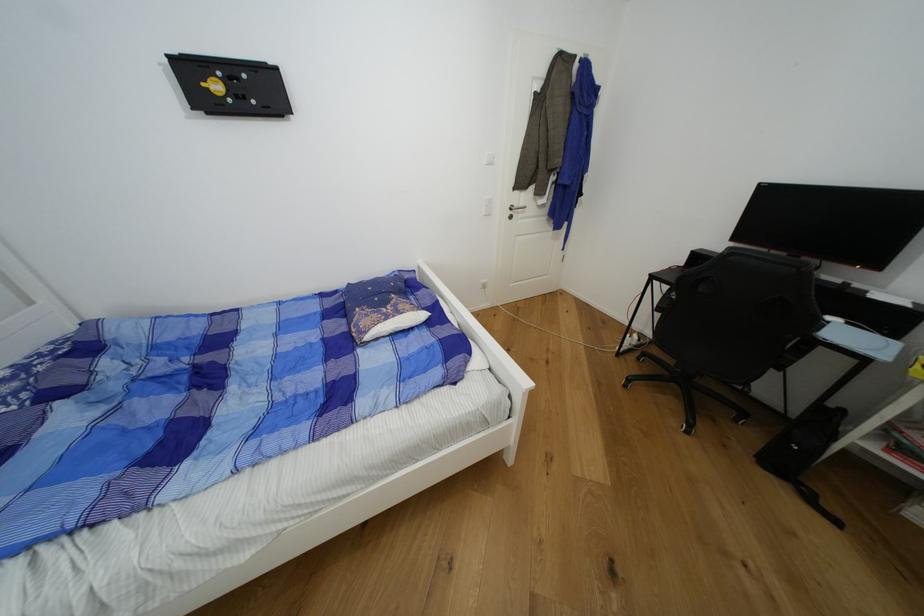
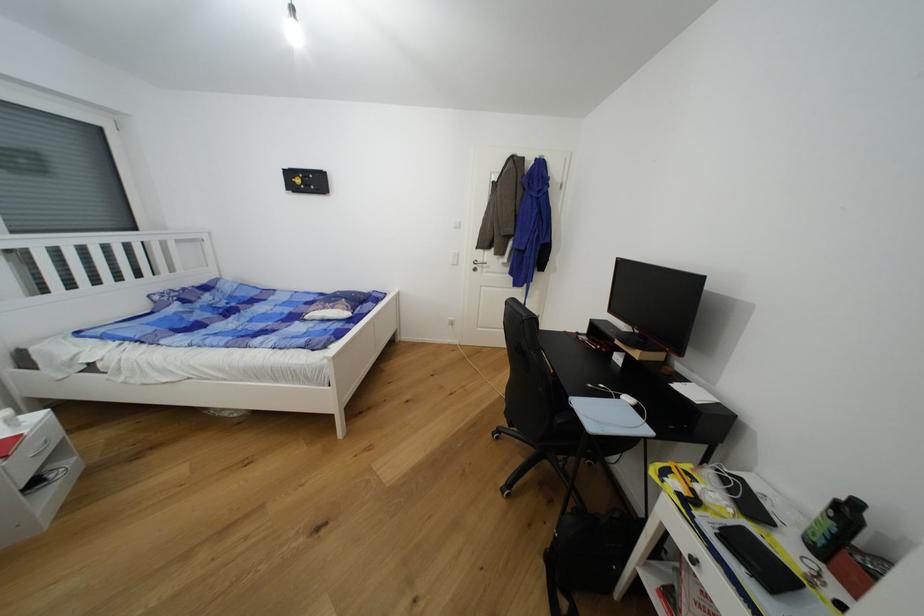
In the second image, find the point that corresponds to point 521,207 in the first image.

(484, 262)